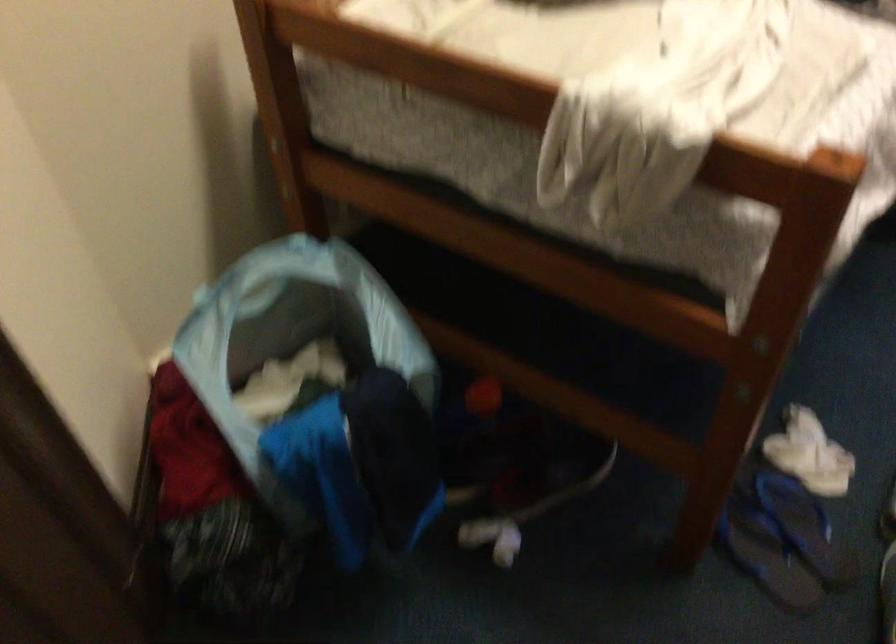
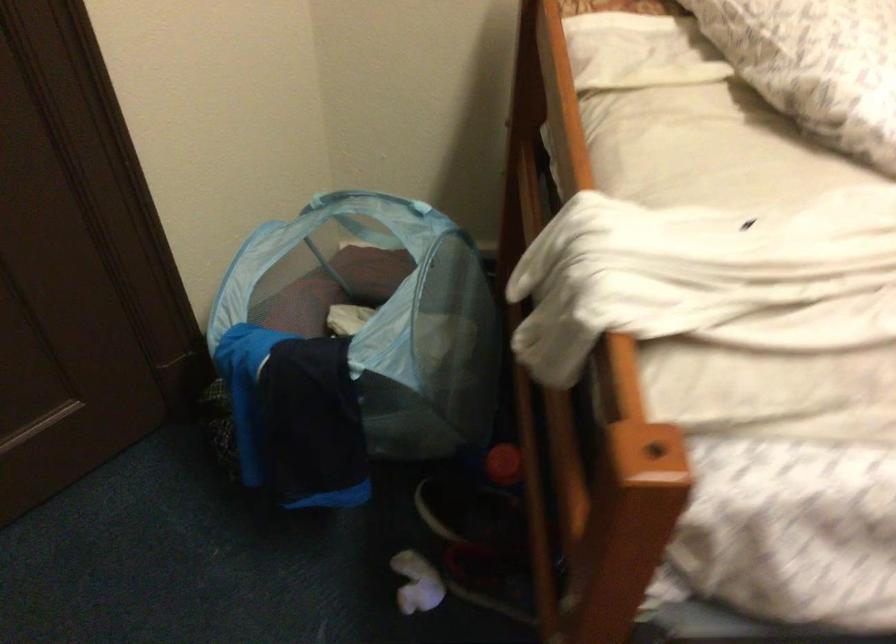
Find the pixel in the second image that matches pixel 487 395 in the first image.

(504, 464)